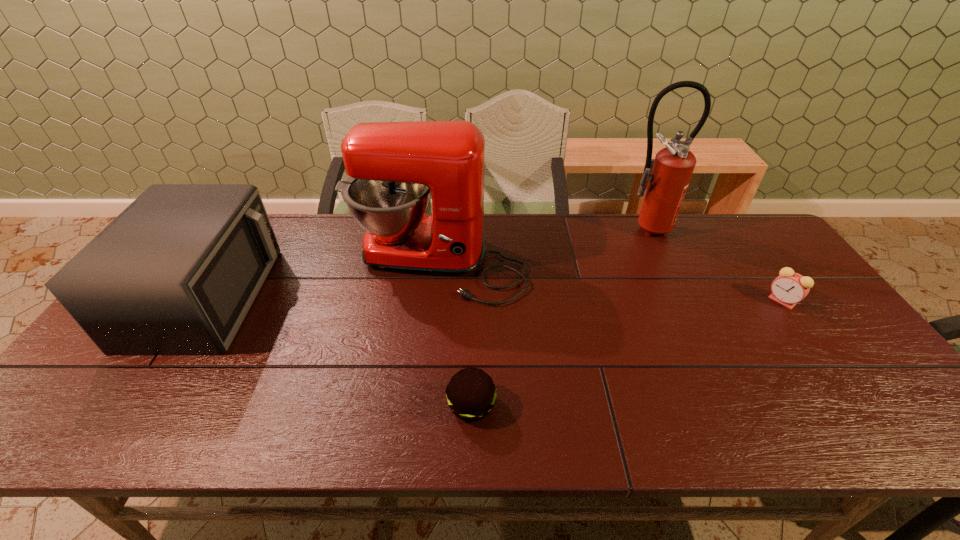
This screenshot has height=540, width=960. In order to click on free space located 0.050m on the face of the alarm clock in this screenshot , I will do `click(751, 301)`.

Locate an element on the screen. vacant space located on the face of the alarm clock is located at coordinates (647, 301).

This screenshot has height=540, width=960. What are the coordinates of `free space located 0.080m on the face of the alarm clock` in the screenshot? It's located at (740, 301).

The width and height of the screenshot is (960, 540). Identify the location of free space located on the right of the patty. (541, 406).

You are a GUI agent. You are given a task and a screenshot of the screen. Output one action in this format:
    pyautogui.click(x=<x>, y=<y>)
    Task: Click on the fire extinguisher present at the far edge
    The width and height of the screenshot is (960, 540).
    Given the screenshot: What is the action you would take?
    click(x=670, y=172)

Where is `kitchen mixer situated at the far edge`? The image size is (960, 540). kitchen mixer situated at the far edge is located at coordinates (393, 166).

Find the location of a particular element. microwave oven that is at the far edge is located at coordinates (174, 274).

Find the location of a particular element. object at the near edge is located at coordinates (471, 394).

Where is `object present at the left edge`? This screenshot has height=540, width=960. object present at the left edge is located at coordinates (174, 274).

Locate an element on the screen. object located in the right edge section of the desktop is located at coordinates (789, 288).